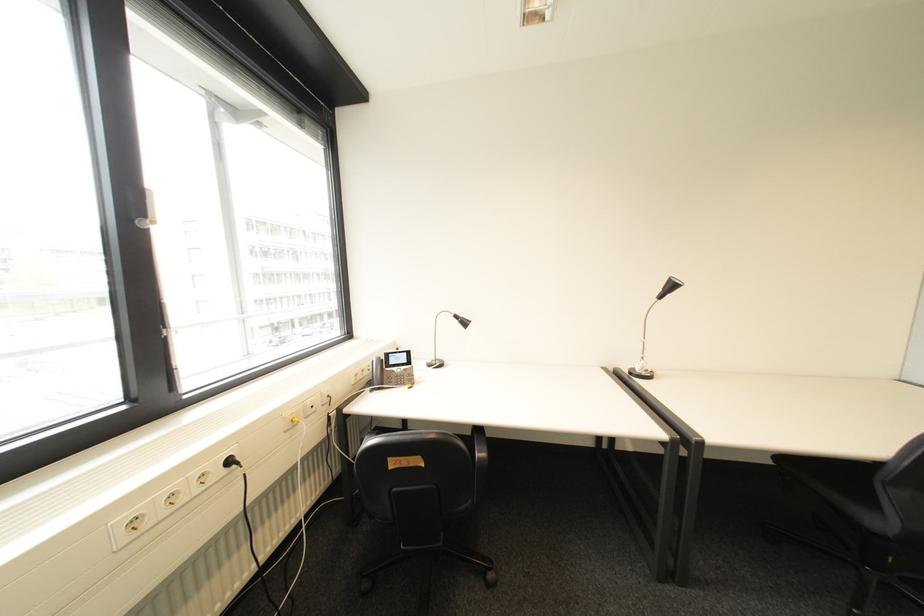
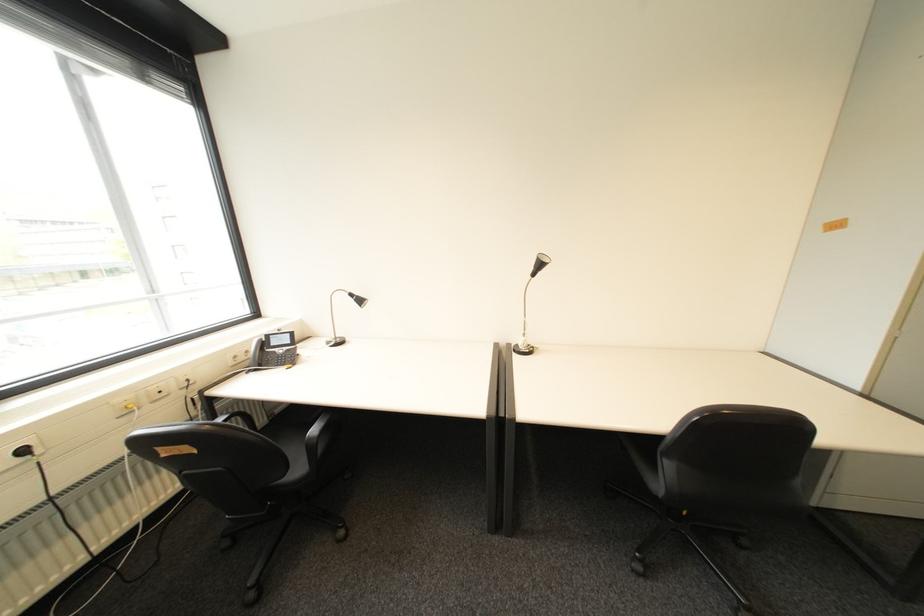
The point at (643, 370) is marked in the first image. Where is the corresponding point in the second image?

(528, 345)